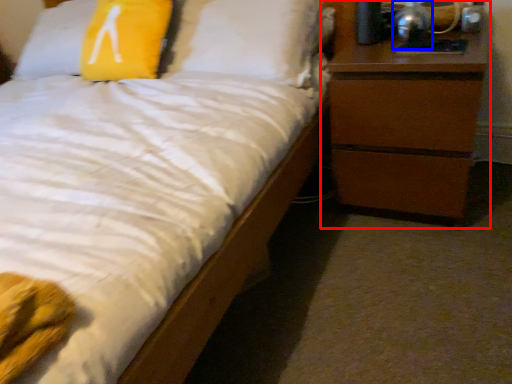
Question: Among these objects, which one is nearest to the camera, chest of drawers (highlighted by a red box) or bedside lamp (highlighted by a blue box)?

Choices:
 (A) chest of drawers
 (B) bedside lamp

Answer: (A)